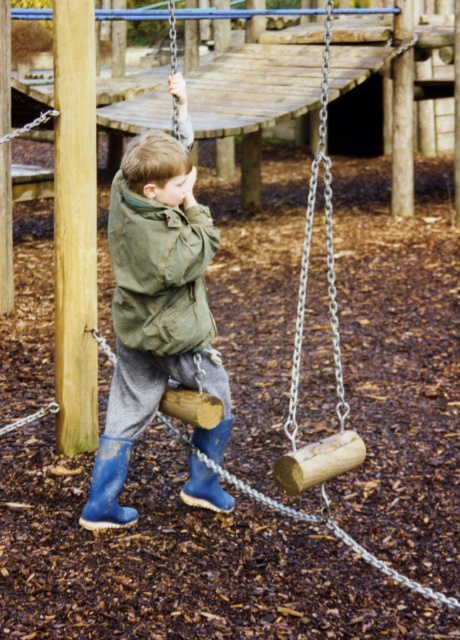
Question: Does matte green jacket at center have a greater width compared to green canvas jacket at center?

Choices:
 (A) yes
 (B) no

Answer: (A)

Question: Which object appears farthest from the camera in this image?

Choices:
 (A) green canvas jacket at center
 (B) matte green jacket at center

Answer: (A)

Question: Considering the relative positions of matte green jacket at center and green canvas jacket at center in the image provided, where is matte green jacket at center located with respect to green canvas jacket at center?

Choices:
 (A) above
 (B) below

Answer: (B)

Question: Can you confirm if matte green jacket at center is positioned above green canvas jacket at center?

Choices:
 (A) yes
 (B) no

Answer: (B)